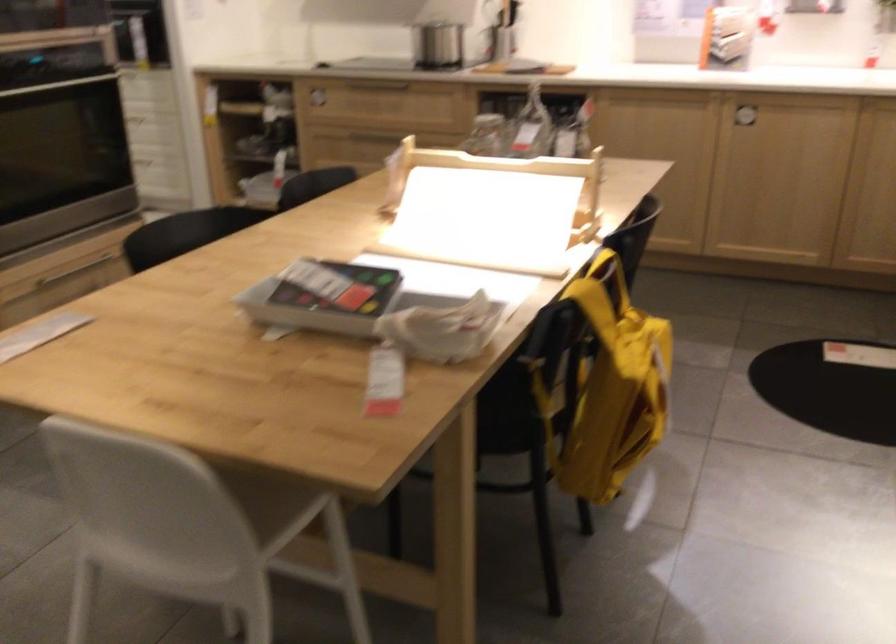
Image resolution: width=896 pixels, height=644 pixels. I want to click on drawer handle, so click(x=316, y=100).